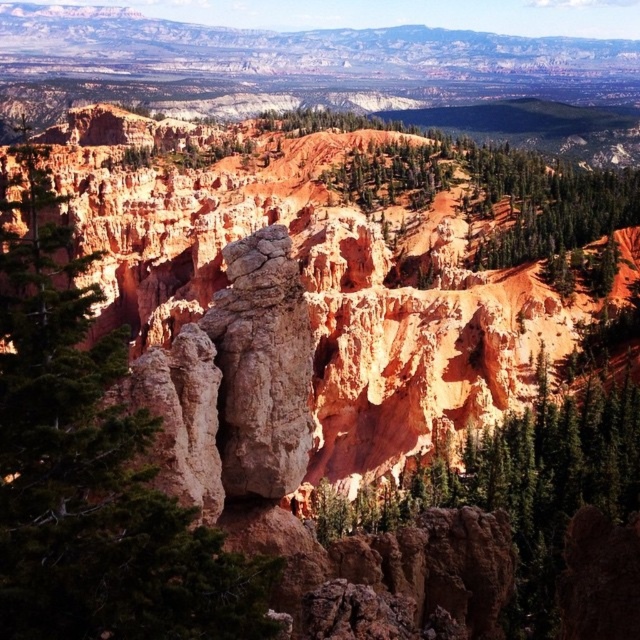
Question: Does green matte tree at left have a lesser width compared to green textured tree at upper center?

Choices:
 (A) no
 (B) yes

Answer: (A)

Question: Which point is closer to the camera?

Choices:
 (A) (100, 524)
 (B) (349, 157)

Answer: (A)

Question: Is green matte tree at left smaller than green textured tree at upper center?

Choices:
 (A) yes
 (B) no

Answer: (B)

Question: Which point appears closest to the camera in this image?

Choices:
 (A) (420, 164)
 (B) (128, 449)

Answer: (B)

Question: Is green matte tree at left below green textured tree at upper center?

Choices:
 (A) yes
 (B) no

Answer: (A)